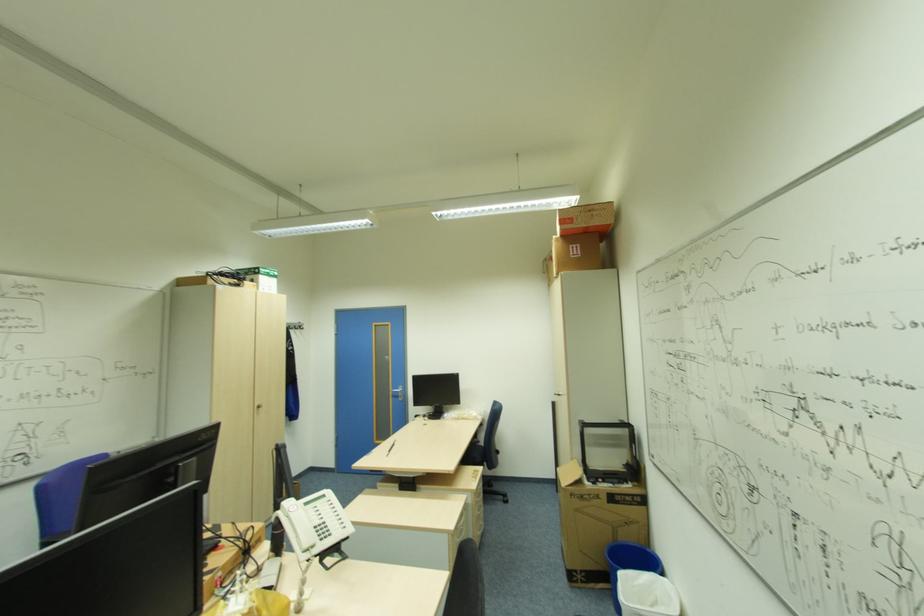
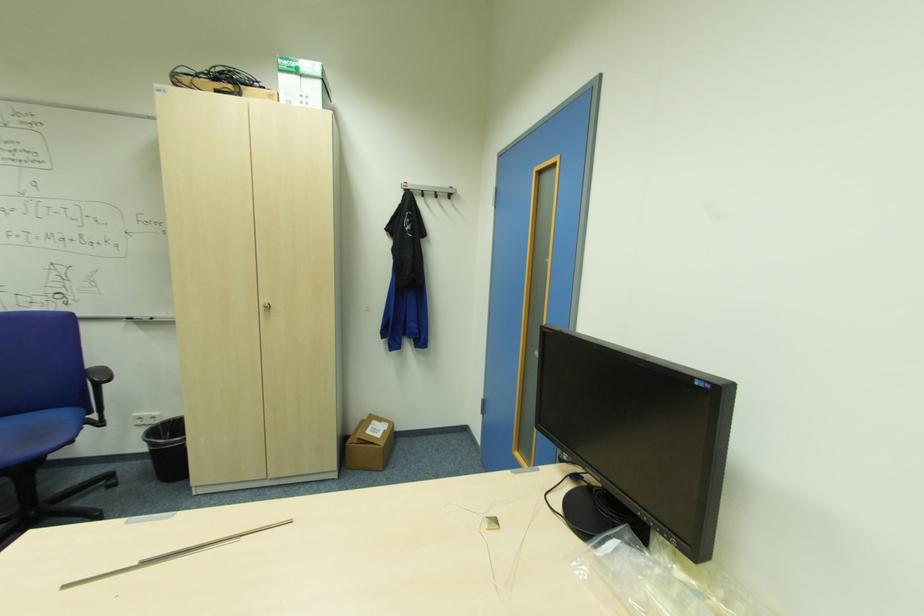
The point at (390, 456) is marked in the first image. Where is the corresponding point in the second image?

(63, 589)